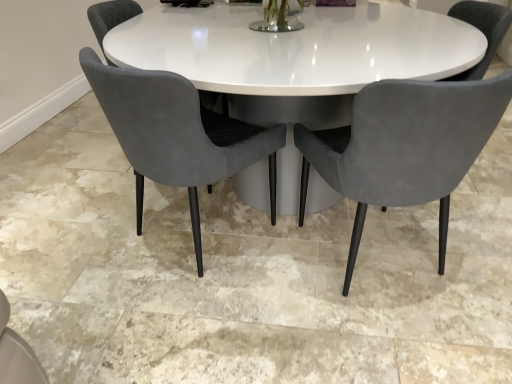
Question: Are velvet grey chair at center, the 1th chair positioned from the left, and velvet grey chair at center, which is counted as the 1th chair, starting from the right, located far from each other?

Choices:
 (A) yes
 (B) no

Answer: (A)

Question: From a real-world perspective, is velvet grey chair at center, arranged as the 3th chair when viewed from the right, positioned over velvet grey chair at center, which is counted as the 1th chair, starting from the right, based on gravity?

Choices:
 (A) yes
 (B) no

Answer: (A)

Question: Is velvet grey chair at center, the 1th chair positioned from the left, to the right of velvet grey chair at center, the 3th chair positioned from the left, from the viewer's perspective?

Choices:
 (A) yes
 (B) no

Answer: (B)

Question: Can you confirm if velvet grey chair at center, the 1th chair positioned from the left, is smaller than velvet grey chair at center, which is counted as the 1th chair, starting from the right?

Choices:
 (A) no
 (B) yes

Answer: (B)

Question: From a real-world perspective, does velvet grey chair at center, arranged as the 3th chair when viewed from the right, sit lower than velvet grey chair at center, the 3th chair positioned from the left?

Choices:
 (A) no
 (B) yes

Answer: (A)

Question: From the image's perspective, is velvet grey chair at center, the 2th chair when ordered from left to right, positioned above or below velvet grey chair at center, the 1th chair positioned from the left?

Choices:
 (A) above
 (B) below

Answer: (B)

Question: Is velvet grey chair at center, which ranks as the second chair in right-to-left order, taller or shorter than velvet grey chair at center, the 1th chair positioned from the left?

Choices:
 (A) short
 (B) tall

Answer: (B)

Question: From a real-world perspective, is velvet grey chair at center, which ranks as the second chair in right-to-left order, physically located above or below velvet grey chair at center, the 1th chair positioned from the left?

Choices:
 (A) below
 (B) above

Answer: (A)

Question: In the image, is velvet grey chair at center, the 2th chair when ordered from left to right, on the left side or the right side of velvet grey chair at center, the 1th chair positioned from the left?

Choices:
 (A) right
 (B) left

Answer: (A)

Question: Is velvet grey chair at center, the 3th chair positioned from the left, situated inside velvet grey chair at center, arranged as the 3th chair when viewed from the right, or outside?

Choices:
 (A) outside
 (B) inside

Answer: (A)

Question: From a real-world perspective, is velvet grey chair at center, which is counted as the 1th chair, starting from the right, above or below velvet grey chair at center, the 1th chair positioned from the left?

Choices:
 (A) above
 (B) below

Answer: (B)

Question: Is point (403, 135) positioned closer to the camera than point (206, 97)?

Choices:
 (A) closer
 (B) farther

Answer: (A)

Question: Based on their positions, is velvet grey chair at center, the 3th chair positioned from the left, located to the left or right of velvet grey chair at center, arranged as the 3th chair when viewed from the right?

Choices:
 (A) left
 (B) right

Answer: (B)

Question: Relative to velvet grey chair at center, which ranks as the second chair in right-to-left order, is velvet grey chair at center, arranged as the 3th chair when viewed from the right, in front or behind?

Choices:
 (A) behind
 (B) front

Answer: (A)

Question: From a real-world perspective, relative to velvet grey chair at center, which ranks as the second chair in right-to-left order, is velvet grey chair at center, the 1th chair positioned from the left, vertically above or below?

Choices:
 (A) above
 (B) below

Answer: (A)